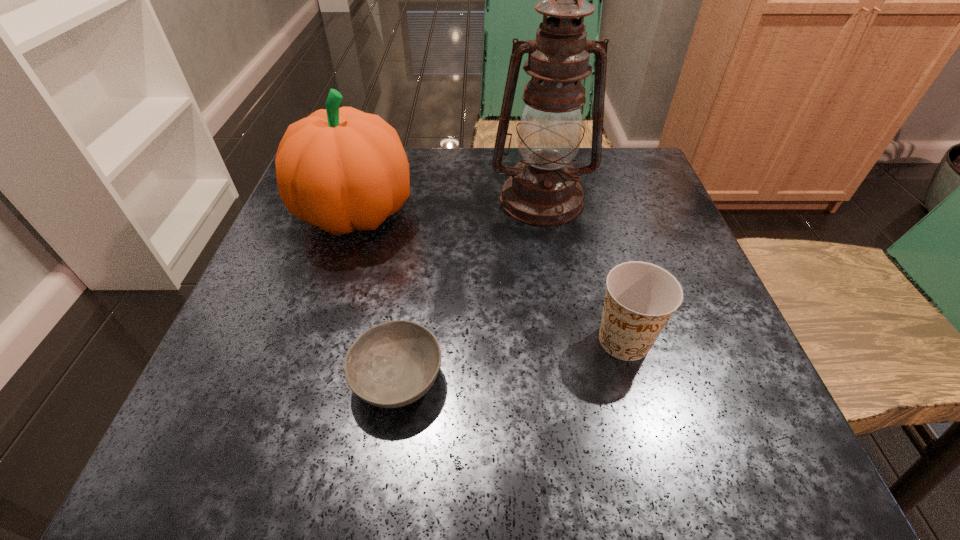
This screenshot has width=960, height=540. In the image, there is a desktop. Find the location of `vacant space at the far right corner`. vacant space at the far right corner is located at coordinates (607, 180).

This screenshot has height=540, width=960. I want to click on free space at the near right corner of the desktop, so click(708, 439).

Find the location of `unoccupied area between the pumpkin and the bowl`. unoccupied area between the pumpkin and the bowl is located at coordinates (376, 296).

In order to click on free space between the tallest object and the bowl in this screenshot , I will do `click(469, 289)`.

The image size is (960, 540). I want to click on free space between the oil lamp and the Dixie cup, so click(x=583, y=270).

You are a GUI agent. You are given a task and a screenshot of the screen. Output one action in this format:
    pyautogui.click(x=<x>, y=<y>)
    Task: Click on the vacant region between the third shortest object and the second shortest object
    This screenshot has height=540, width=960.
    Given the screenshot: What is the action you would take?
    pyautogui.click(x=490, y=277)

At what (x,y) coordinates should I click in order to perform the action: click on vacant space that's between the bowl and the Dixie cup. Please return your answer as a coordinate pair (x, y). The width and height of the screenshot is (960, 540). Looking at the image, I should click on (511, 360).

What are the coordinates of `vacant point located between the oil lamp and the third tallest object` in the screenshot? It's located at (583, 270).

Identify the location of free point between the shortest object and the oil lamp. This screenshot has height=540, width=960. (469, 289).

Image resolution: width=960 pixels, height=540 pixels. In order to click on vacant space in between the pumpkin and the tallest object in this screenshot , I will do `click(448, 207)`.